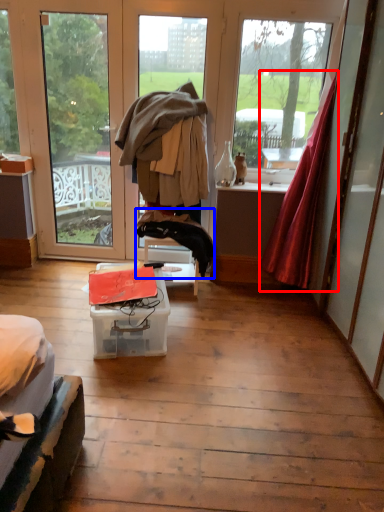
Question: Which object is further to the camera taking this photo, curtain (highlighted by a red box) or clothing (highlighted by a blue box)?

Choices:
 (A) curtain
 (B) clothing

Answer: (B)